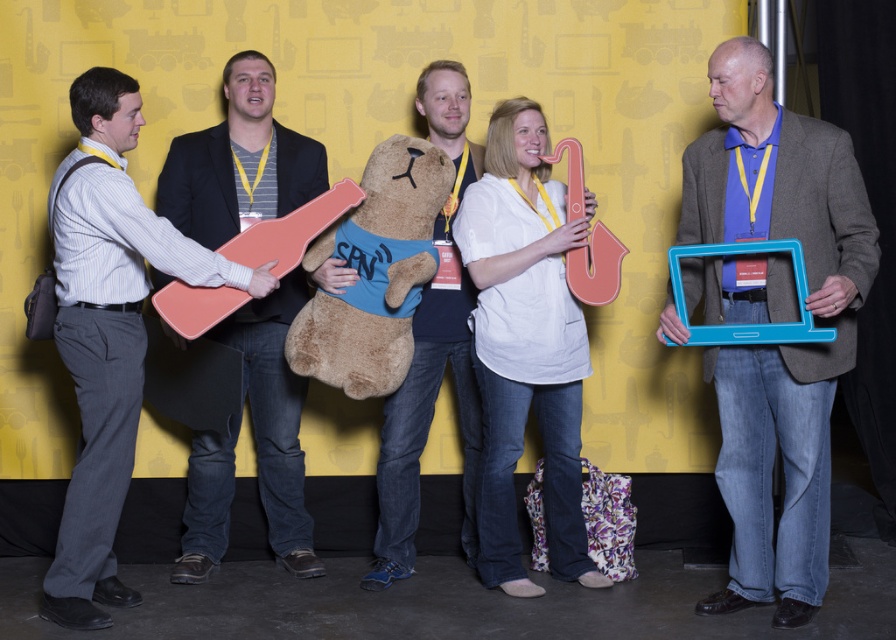
Question: Among these points, which one is farthest from the camera?

Choices:
 (A) (429, 145)
 (B) (831, 125)
 (C) (135, 132)
 (D) (300, 499)

Answer: (D)

Question: Can you confirm if blue fabric frame at right is wider than matte gray pants at left?

Choices:
 (A) yes
 (B) no

Answer: (B)

Question: Among these points, which one is farthest from the camera?

Choices:
 (A) (261, 428)
 (B) (289, 355)

Answer: (A)

Question: Can you confirm if blue fabric frame at right is positioned below matte gray pants at left?

Choices:
 (A) no
 (B) yes

Answer: (A)

Question: Does soft plush bear at center have a lesser width compared to brown plush teddy bear at center?

Choices:
 (A) no
 (B) yes

Answer: (B)

Question: Which object is positioned closest to the white matte saxophone at center?

Choices:
 (A) soft plush bear at center
 (B) brown plush teddy bear at center
 (C) matte gray pants at left
 (D) blue fabric frame at right

Answer: (A)